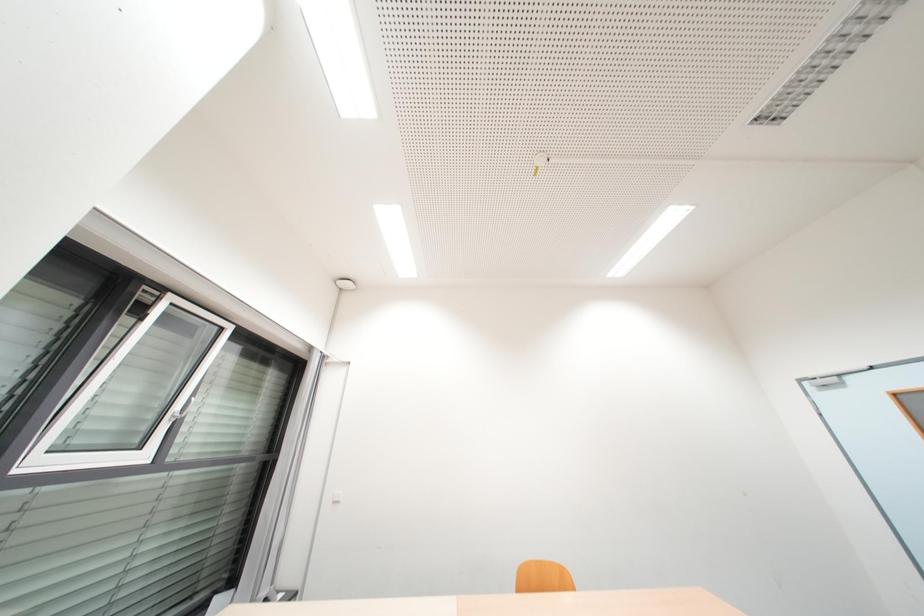
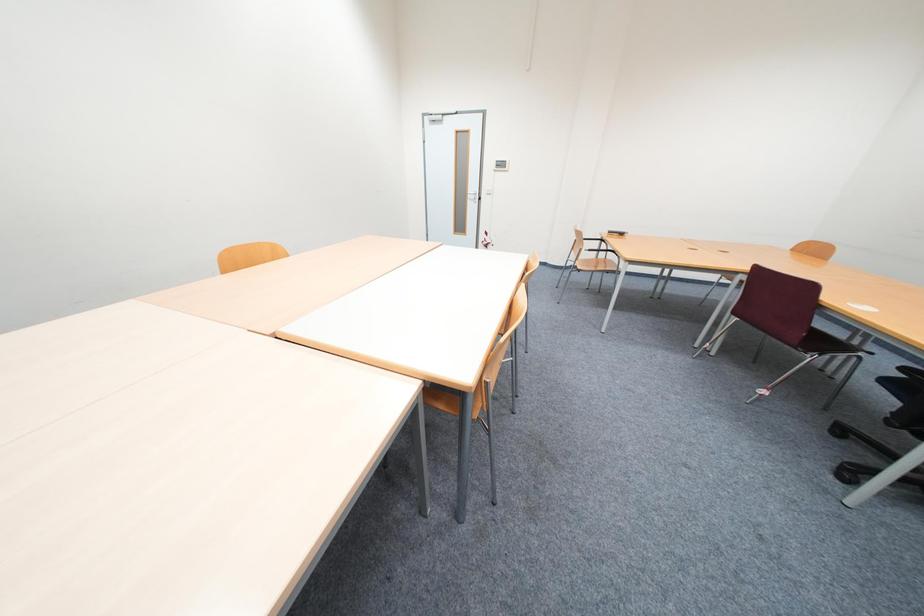
How did the camera likely rotate?

The camera's rotation is toward right-down.